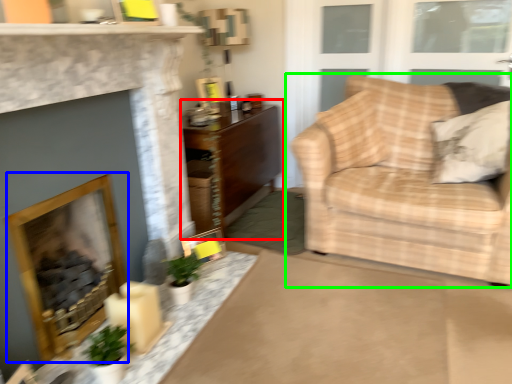
Question: Which object is the closest to the table (highlighted by a red box)? Choose among these: fireplace (highlighted by a blue box) or studio couch (highlighted by a green box).

Choices:
 (A) fireplace
 (B) studio couch

Answer: (B)